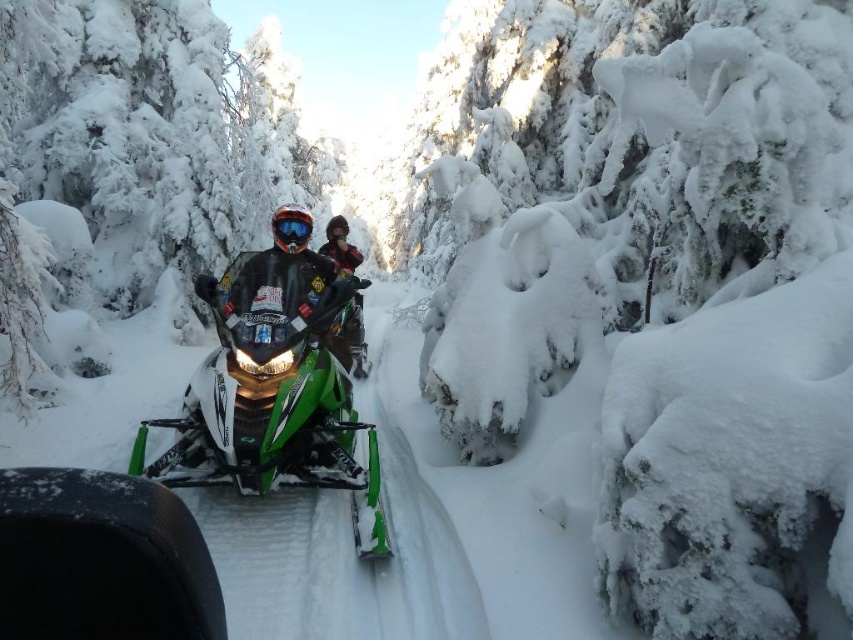
You are navigating a snowmobile through a narrow forest path. There is a point at coordinates (271, 397). Is this point located on the green matte snowmobile at center?

Yes, the point (271, 397) is on the green matte snowmobile at center.